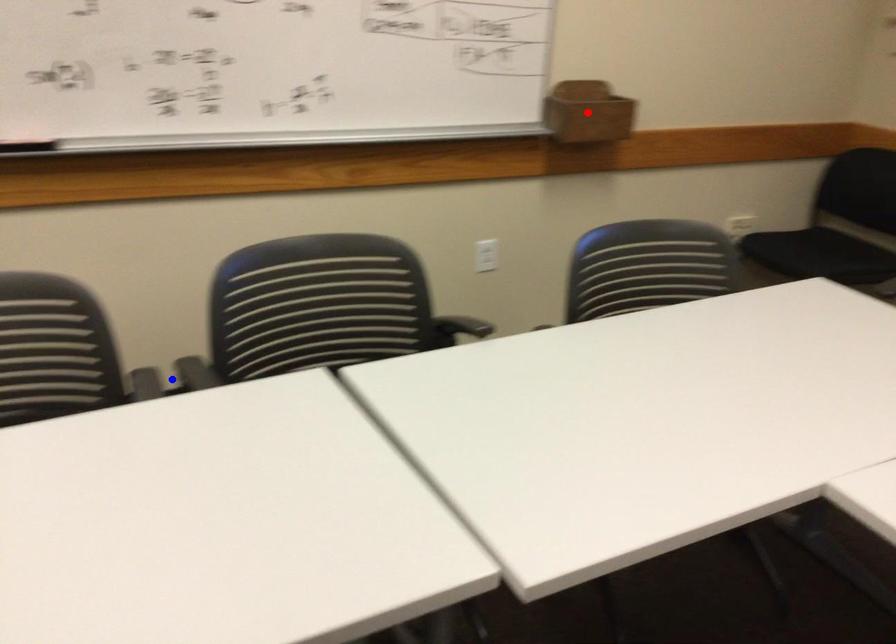
Question: Which of the two points in the image is closer to the camera?

Choices:
 (A) Blue point is closer.
 (B) Red point is closer.

Answer: (A)